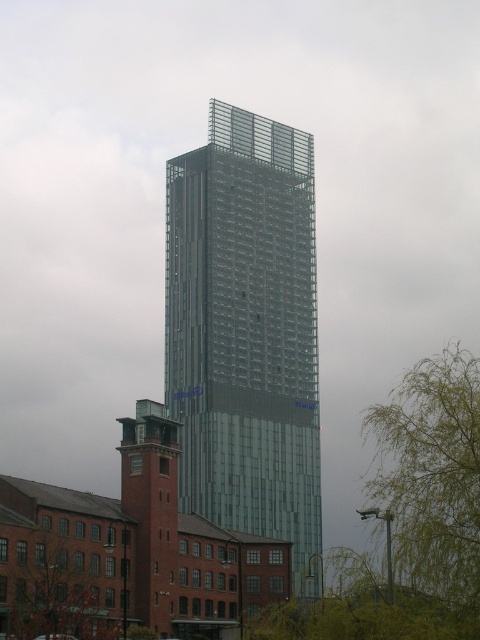
You are standing in front of the modern high rise and the older brick building. You notice two points marked on the image. One is at coordinate point (192, 321) and the other at point (428, 630). Which point is closer to you?

Point (192, 321) is closer to you because it is further to the viewer than point (428, 630).

You are standing at the base of the modern highrise and want to water the green leafy tree at center. Your hose can reach up to 40 meters. Can you reach the tree with your current hose?

The green leafy tree at center is 45.87 meters away from the viewer. Since the hose can only reach up to 40 meters, you cannot reach the tree with your current hose.